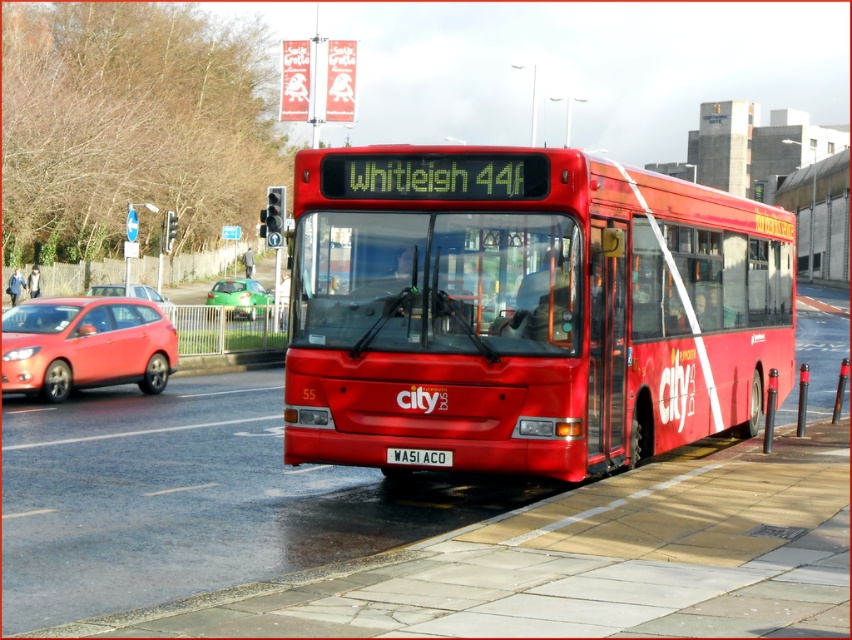
Question: Which point is farther from the camera taking this photo?

Choices:
 (A) (430, 451)
 (B) (499, 454)
 (C) (158, 292)
 (D) (246, 310)

Answer: (C)

Question: Among these points, which one is nearest to the camera?

Choices:
 (A) [x=114, y=288]
 (B) [x=47, y=324]
 (C) [x=427, y=461]
 (D) [x=513, y=269]

Answer: (C)

Question: Which point is farther from the camera taking this photo?

Choices:
 (A) (147, 289)
 (B) (392, 458)

Answer: (A)

Question: Does matte red hatchback at left come behind green glossy car at left?

Choices:
 (A) yes
 (B) no

Answer: (B)

Question: Is matte red hatchback at left to the right of green glossy car at left from the viewer's perspective?

Choices:
 (A) no
 (B) yes

Answer: (B)

Question: Does shiny red bus at center appear on the right side of matte red hatchback at left?

Choices:
 (A) yes
 (B) no

Answer: (A)